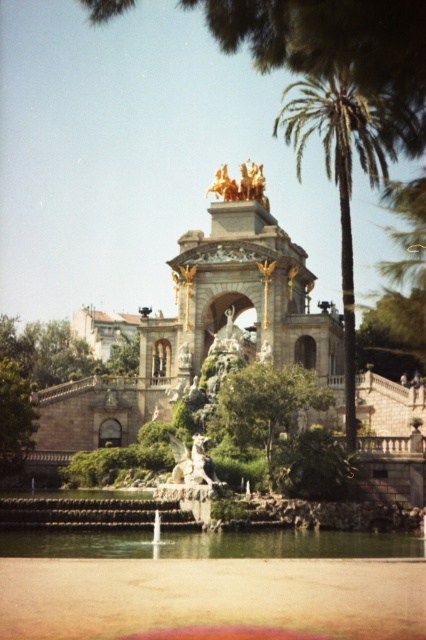
Question: Which object is farther from the camera taking this photo?

Choices:
 (A) clear water at center
 (B) green leafy palm tree at upper right
 (C) green leafy tree at left
 (D) green leafy tree at center

Answer: (C)

Question: Estimate the real-world distances between objects in this image. Which object is farther from the clear water at center?

Choices:
 (A) green leafy palm tree at upper right
 (B) green leafy tree at center

Answer: (A)

Question: Is clear water at center above green leafy tree at left?

Choices:
 (A) yes
 (B) no

Answer: (B)

Question: Can you confirm if green leafy tree at center is positioned above green leafy tree at left?

Choices:
 (A) no
 (B) yes

Answer: (B)

Question: Can you confirm if clear water at center is smaller than green leafy tree at left?

Choices:
 (A) no
 (B) yes

Answer: (A)

Question: Which object is closer to the camera taking this photo?

Choices:
 (A) clear water at center
 (B) green leafy tree at center
 (C) green leafy palm tree at upper right

Answer: (A)